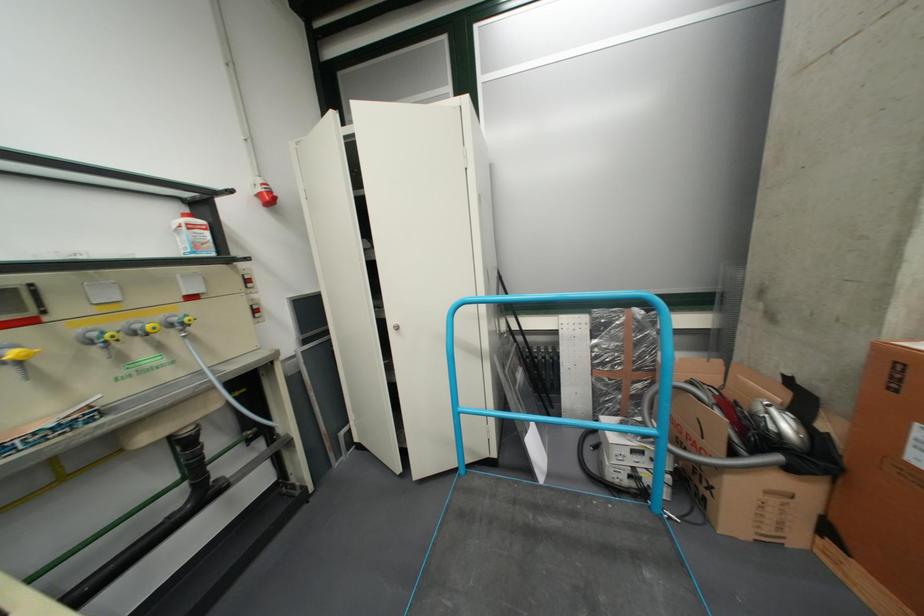
Find the location of a particular element. The image size is (924, 616). blue cart handle is located at coordinates (629, 452).